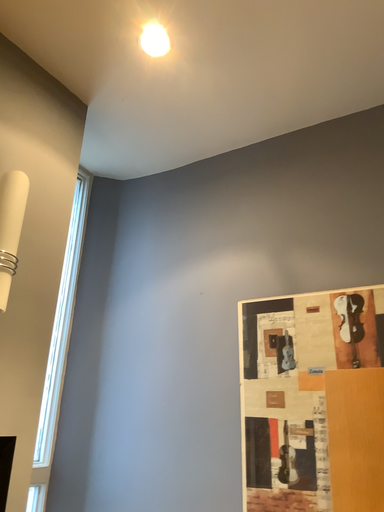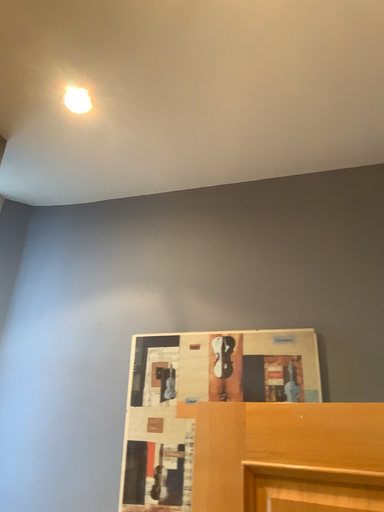
Question: How did the camera likely rotate when shooting the video?

Choices:
 (A) rotated left
 (B) rotated right

Answer: (B)